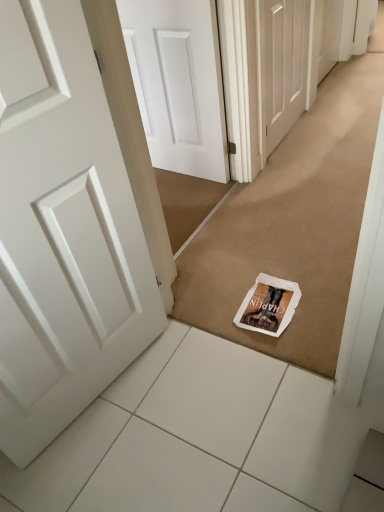
The image size is (384, 512). What do you see at coordinates (199, 437) in the screenshot?
I see `white tile at lower center` at bounding box center [199, 437].

The image size is (384, 512). What are the coordinates of `white paper magazine at center` in the screenshot? It's located at (268, 305).

I want to click on white matte door at center, positioned as the 1th door in back-to-front order, so click(x=285, y=65).

At what (x,y) coordinates should I click in order to perform the action: click on white tile at lower center. Please return your answer as a coordinate pair (x, y). This screenshot has height=512, width=384. Looking at the image, I should click on (199, 437).

From their relative heights in the image, would you say white paper magazine at center is taller or shorter than white matte door at left, which is the 1th door from front to back?

In the image, white paper magazine at center appears to be shorter than white matte door at left, which is the 1th door from front to back.

From a real-world perspective, is white paper magazine at center physically below white matte door at left, which is the 1th door from front to back?

Yes, from a real-world perspective, white paper magazine at center is below white matte door at left, which is the 1th door from front to back.

Is white matte door at left, acting as the 2th door starting from the right, at the back of white paper magazine at center?

No, white paper magazine at center is not facing the opposite direction of white matte door at left, acting as the 2th door starting from the right.

Is white paper magazine at center thinner than white matte door at left, which is the second door in back-to-front order?

No, white paper magazine at center is not thinner than white matte door at left, which is the second door in back-to-front order.

Is white matte door at center, acting as the second door starting from the left, positioned with its back to white matte door at left, which is counted as the 1th door, starting from the left?

white matte door at center, acting as the second door starting from the left, does not have its back to white matte door at left, which is counted as the 1th door, starting from the left.

Are white matte door at center, acting as the second door starting from the left, and white matte door at left, the 2th door when ordered from top to bottom, beside each other?

No, white matte door at center, acting as the second door starting from the left, is not making contact with white matte door at left, the 2th door when ordered from top to bottom.

Considering the relative sizes of white matte door at center, acting as the second door starting from the left, and white matte door at left, acting as the 2th door starting from the right, in the image provided, is white matte door at center, acting as the second door starting from the left, bigger than white matte door at left, acting as the 2th door starting from the right,?

No, white matte door at center, acting as the second door starting from the left, is not bigger than white matte door at left, acting as the 2th door starting from the right.

From the image's perspective, which one is positioned higher, white matte door at center, acting as the second door starting from the left, or white matte door at left, positioned as the 1th door in bottom-to-top order?

white matte door at center, acting as the second door starting from the left.

Can you confirm if white matte door at left, which is the 1th door from front to back, is taller than white paper magazine at center?

Correct, white matte door at left, which is the 1th door from front to back, is much taller as white paper magazine at center.

Between white matte door at left, the 2th door when ordered from top to bottom, and white paper magazine at center, which one is positioned in front?

white matte door at left, the 2th door when ordered from top to bottom.

Does white matte door at left, positioned as the 1th door in bottom-to-top order, have a lesser width compared to white paper magazine at center?

Yes, white matte door at left, positioned as the 1th door in bottom-to-top order, is thinner than white paper magazine at center.

Is point (37, 67) closer or farther from the camera than point (291, 319)?

Point (37, 67) is closer to the camera than point (291, 319).

Can you confirm if white matte door at center, arranged as the 1th door when viewed from the top, is positioned to the right of white paper doormat at center?

Incorrect, white matte door at center, arranged as the 1th door when viewed from the top, is not on the right side of white paper doormat at center.

Considering the relative sizes of white matte door at center, acting as the second door starting from the left, and white paper doormat at center in the image provided, is white matte door at center, acting as the second door starting from the left, smaller than white paper doormat at center?

Yes, white matte door at center, acting as the second door starting from the left, is smaller than white paper doormat at center.

Does white matte door at center, which ranks as the 2th door in front-to-back order, have a lesser width compared to white paper doormat at center?

Indeed, white matte door at center, which ranks as the 2th door in front-to-back order, has a lesser width compared to white paper doormat at center.

You are a GUI agent. You are given a task and a screenshot of the screen. Output one action in this format:
    pyautogui.click(x=<x>, y=<y>)
    Task: Click on the doormat that appears above the white matte door at left, which is counted as the 1th door, starting from the left (from the image's perspective)
    Image resolution: width=384 pixels, height=512 pixels.
    Given the screenshot: What is the action you would take?
    pyautogui.click(x=293, y=225)

Is white matte door at left, acting as the 2th door starting from the right, closer to camera compared to white paper doormat at center?

Yes, it is in front of white paper doormat at center.

From a real-world perspective, is white matte door at left, which is the second door in back-to-front order, positioned over white paper doormat at center based on gravity?

Yes, from a real-world perspective, white matte door at left, which is the second door in back-to-front order, is on top of white paper doormat at center.

Considering the positions of point (151, 442) and point (108, 209), is point (151, 442) closer or farther from the camera than point (108, 209)?

Point (151, 442).

Who is shorter, white tile at lower center or white matte door at left, the 2th door when ordered from top to bottom?

With less height is white tile at lower center.

Which object is more forward, white tile at lower center or white matte door at left, acting as the 2th door starting from the right?

white matte door at left, acting as the 2th door starting from the right, is more forward.

Find the location of a particular element. door to the left of white tile at lower center is located at coordinates (63, 231).

Between white paper magazine at center and white tile at lower center, which one has larger size?

white tile at lower center.

Are white paper magazine at center and white tile at lower center beside each other?

white paper magazine at center and white tile at lower center are clearly separated.

What's the angular difference between white paper magazine at center and white tile at lower center's facing directions?

The angular difference between white paper magazine at center and white tile at lower center is 1.34 degrees.

From the image's perspective, who appears lower, white paper magazine at center or white tile at lower center?

white tile at lower center, from the image's perspective.

The height and width of the screenshot is (512, 384). I want to click on door lying in front of the white paper magazine at center, so click(x=63, y=231).

I want to click on door below the white matte door at center, acting as the second door starting from the left (from the image's perspective), so click(63, 231).

Looking at this image, considering their positions, is white tile at lower center positioned closer to white paper doormat at center than white matte door at center, acting as the second door starting from the left?

The object closer to white paper doormat at center is white matte door at center, acting as the second door starting from the left.

Which object lies nearer to the anchor point white matte door at center, which ranks as the 2th door in front-to-back order, white tile at lower center or white paper doormat at center?

white paper doormat at center.

Considering their positions, is white tile at lower center positioned closer to white paper doormat at center than white paper magazine at center?

The object closer to white paper doormat at center is white paper magazine at center.

Estimate the real-world distances between objects in this image. Which object is further from white matte door at left, the 2th door when ordered from top to bottom, white paper magazine at center or white paper doormat at center?

white paper doormat at center is further to white matte door at left, the 2th door when ordered from top to bottom.

Which object lies further to the anchor point white tile at lower center, white matte door at center, positioned as the 1th door in back-to-front order, or white paper doormat at center?

white matte door at center, positioned as the 1th door in back-to-front order.

Which object lies further to the anchor point white tile at lower center, white paper magazine at center or white matte door at left, which is the second door in back-to-front order?

white matte door at left, which is the second door in back-to-front order, lies further to white tile at lower center than the other object.

Looking at the image, which one is located closer to white matte door at center, which ranks as the 2th door in front-to-back order, white paper doormat at center or white tile at lower center?

white paper doormat at center is closer to white matte door at center, which ranks as the 2th door in front-to-back order.

Based on their spatial positions, is white paper doormat at center or white matte door at center, arranged as the 1th door when viewed from the top, closer to white matte door at left, the 2th door when ordered from top to bottom?

white paper doormat at center is closer to white matte door at left, the 2th door when ordered from top to bottom.

Locate an element on the screen. doormat between white matte door at left, which is counted as the 1th door, starting from the left, and white matte door at center, arranged as the 1th door when viewed from the top, along the z-axis is located at coordinates (293, 225).

The width and height of the screenshot is (384, 512). What are the coordinates of `magazine located between white matte door at left, positioned as the 1th door in bottom-to-top order, and white paper doormat at center in the left-right direction` in the screenshot? It's located at (268, 305).

Find the location of a particular element. door that lies between white matte door at center, arranged as the 1th door when viewed from the top, and white tile at lower center from top to bottom is located at coordinates (63, 231).

Identify the location of doormat that lies between white matte door at center, which ranks as the 2th door in front-to-back order, and white paper magazine at center from top to bottom. (293, 225).